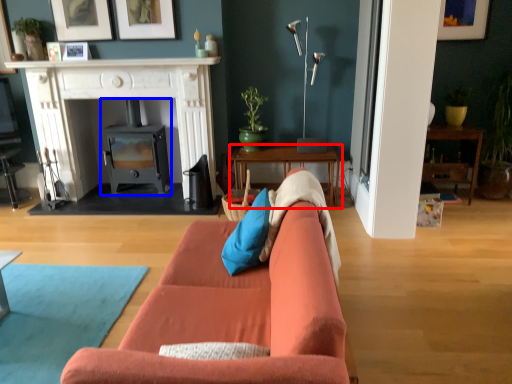
Question: Which object appears closest to the camera in this image, table (highlighted by a red box) or wood burning stove (highlighted by a blue box)?

Choices:
 (A) table
 (B) wood burning stove

Answer: (A)